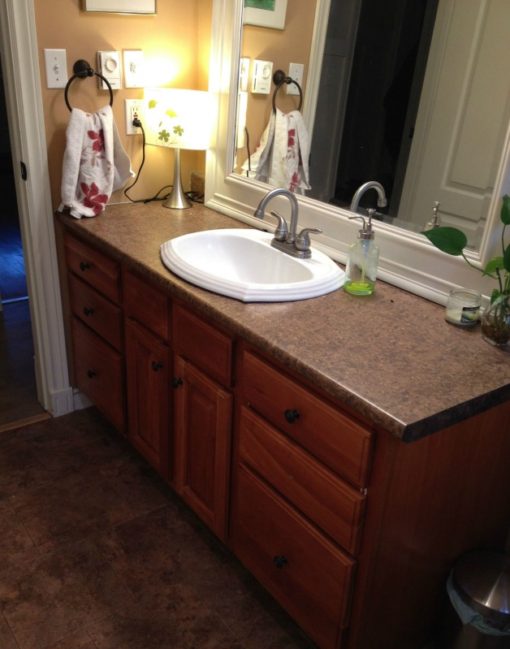
Find the location of a particular element. cabinet is located at coordinates (395, 570).